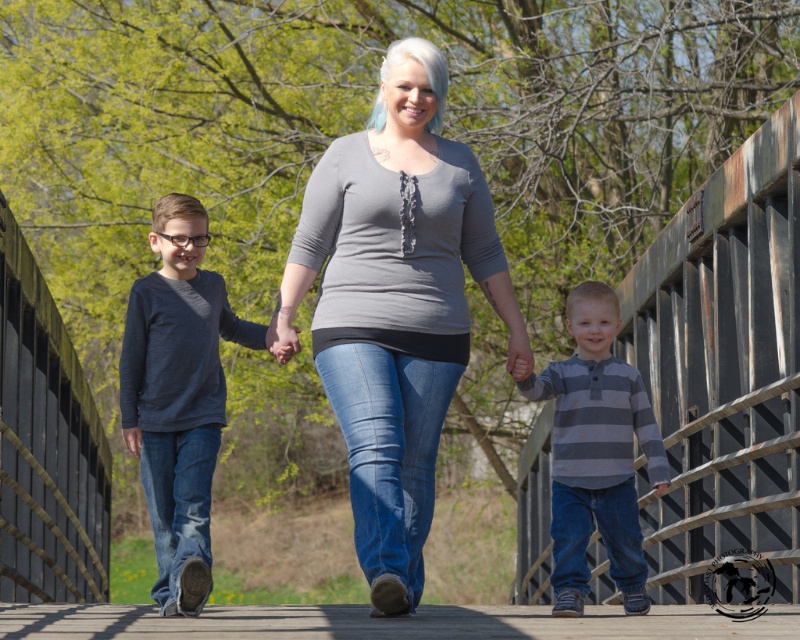
You are a photographer trying to capture a clear shot of both the gray textured shirt at center and the gray striped shirt at center. Since the camera can only focus on one subject at a time, which shirt should you choose to ensure the other is still in the frame?

The gray textured shirt at center is wider than the gray striped shirt at center, so focusing on the wider shirt would keep the narrower one in the frame.